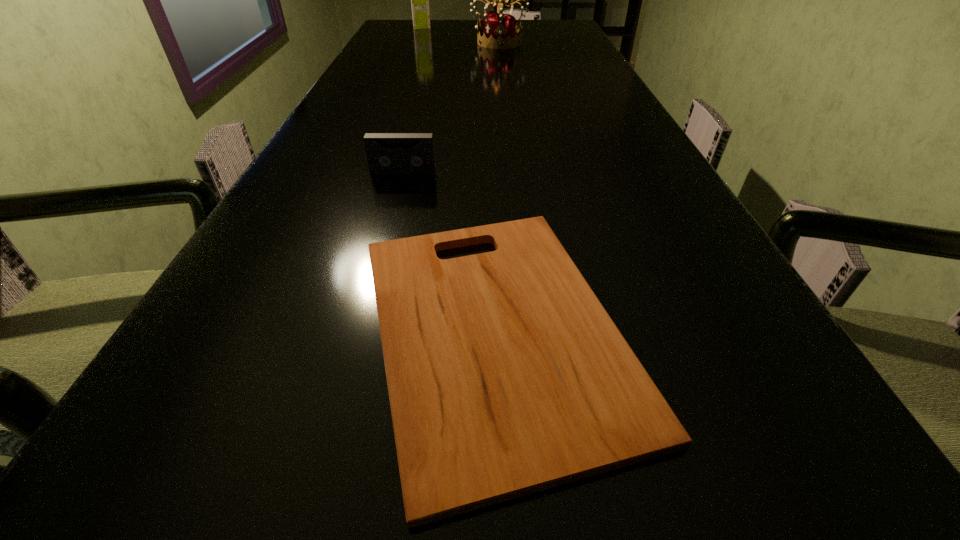
Find the location of a particular element. the farthest object is located at coordinates (419, 0).

Where is `the third nearest object`? The width and height of the screenshot is (960, 540). the third nearest object is located at coordinates (499, 31).

Locate an element on the screen. This screenshot has width=960, height=540. the second shortest object is located at coordinates (387, 153).

Locate an element on the screen. the second nearest object is located at coordinates (387, 153).

This screenshot has height=540, width=960. I want to click on the nearest object, so click(x=506, y=376).

The width and height of the screenshot is (960, 540). I want to click on the shortest object, so [x=506, y=376].

Where is `vacant region located 0.060m on the back of the farthest object`? This screenshot has width=960, height=540. vacant region located 0.060m on the back of the farthest object is located at coordinates (424, 21).

Where is `free space located 0.130m on the front-facing side of the tiara`? free space located 0.130m on the front-facing side of the tiara is located at coordinates (501, 62).

Locate an element on the screen. vacant point located on the front-facing side of the third tallest object is located at coordinates (383, 248).

Identify the location of vacant space located on the left of the shortest object. Image resolution: width=960 pixels, height=540 pixels. point(300,329).